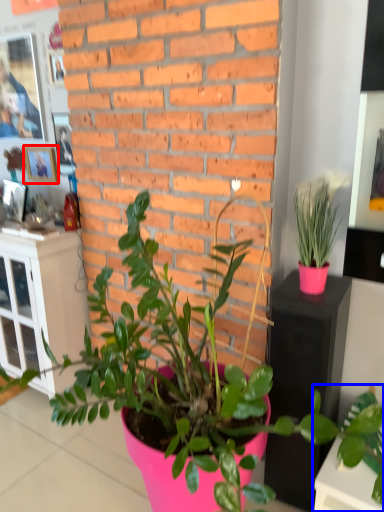
Question: Which object is closer to the camera taking this photo, picture frame (highlighted by a red box) or houseplant (highlighted by a blue box)?

Choices:
 (A) picture frame
 (B) houseplant

Answer: (B)